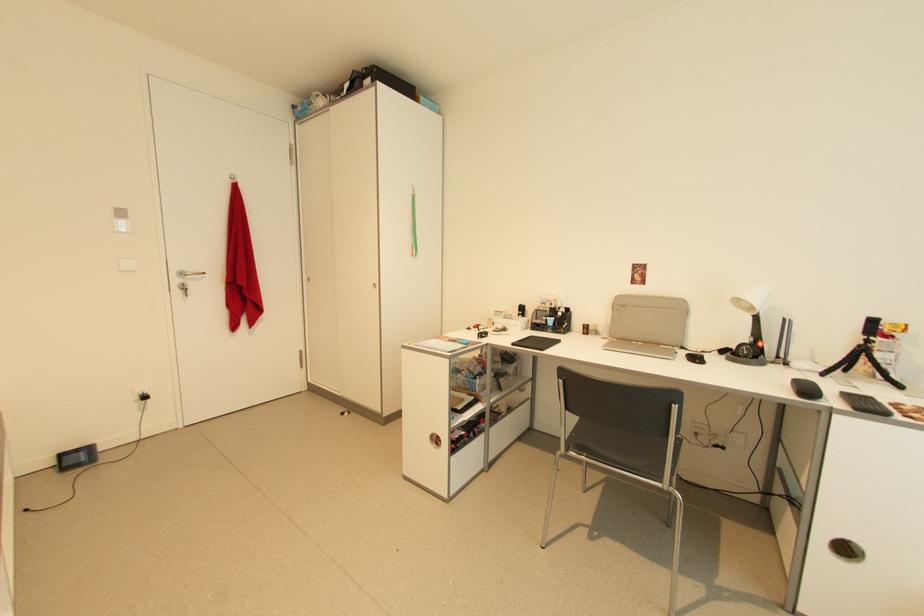
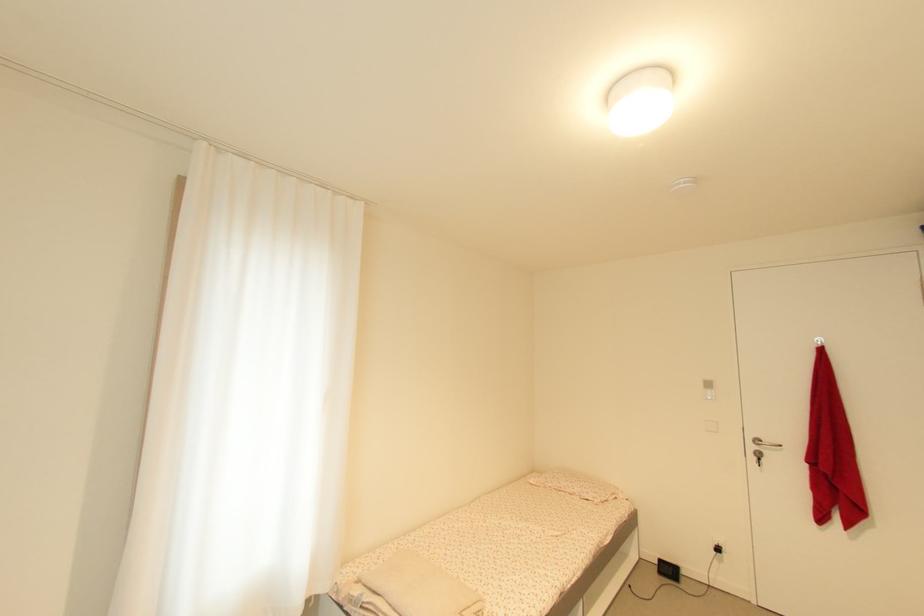
Question: Based on the continuous images, in which direction is the camera rotating? Reply with the corresponding letter.

Choices:
 (A) Left
 (B) Right
 (C) Up
 (D) Down

Answer: (A)